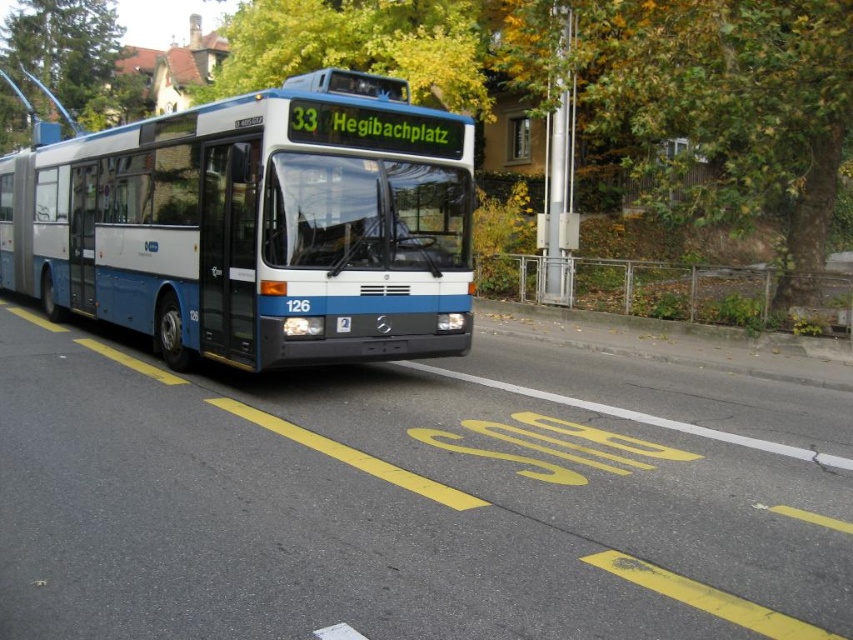
You are a passenger on the bus and looking out the window. You see a green leafy tree at upper center and a blue metallic license plate at center. Which object is closer to the left side of the bus?

The green leafy tree at upper center is positioned on the left side of the blue metallic license plate at center, so it is closer to the left side of the bus.